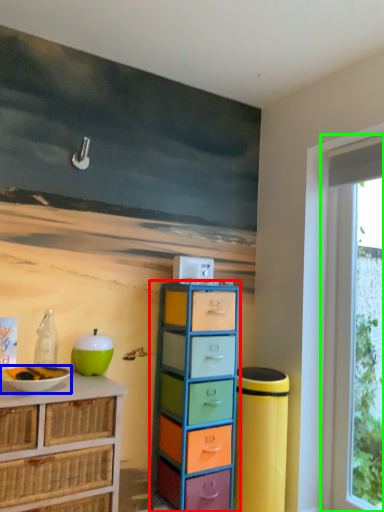
Question: Based on their relative distances, which object is nearer to chest of drawers (highlighted by a red box)? Choose from bowl (highlighted by a blue box) and window (highlighted by a green box).

Choices:
 (A) bowl
 (B) window

Answer: (A)